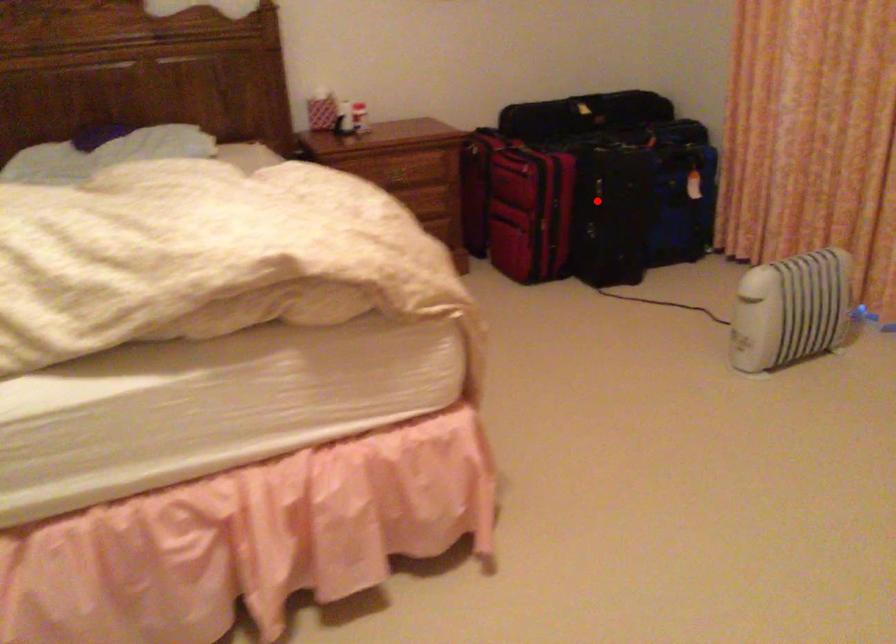
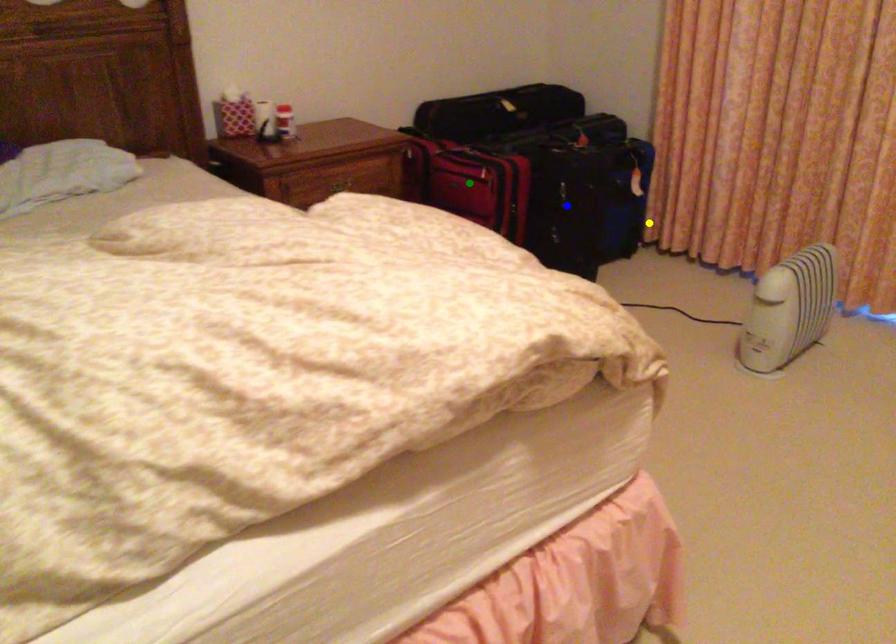
Question: I am providing you with two images of the same scene from different viewpoints. A red point is marked on the first image. You are given multiple points on the second image. Which point in image 2 represents the same 3d spot as the red point in image 1?

Choices:
 (A) green point
 (B) blue point
 (C) yellow point

Answer: (B)